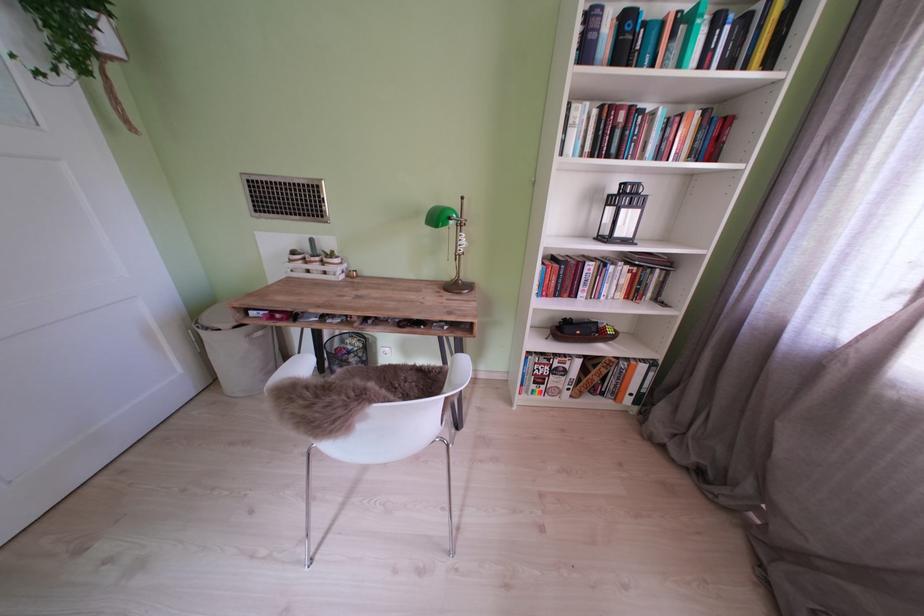
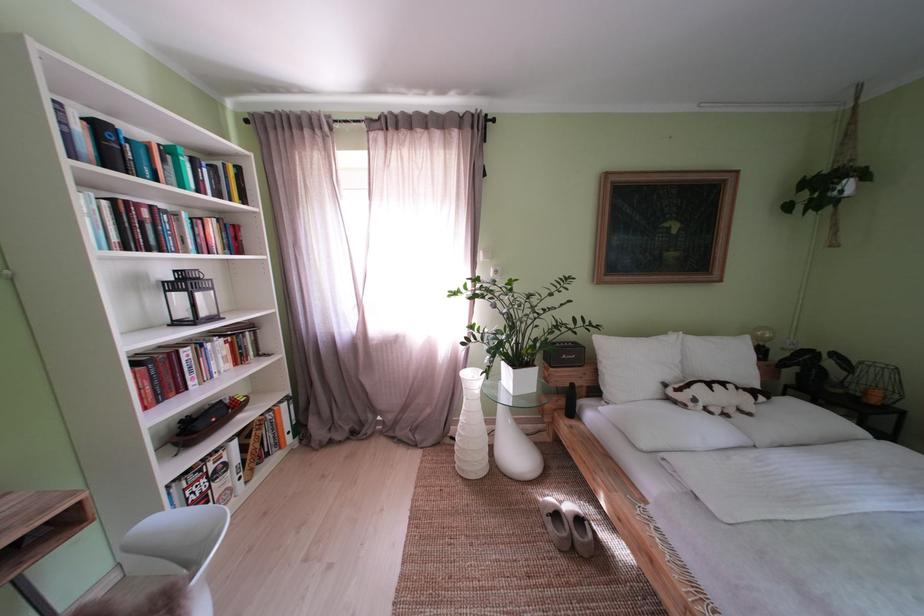
Where in the second image is the point corresponding to (x=601, y=273) from the first image?

(199, 359)